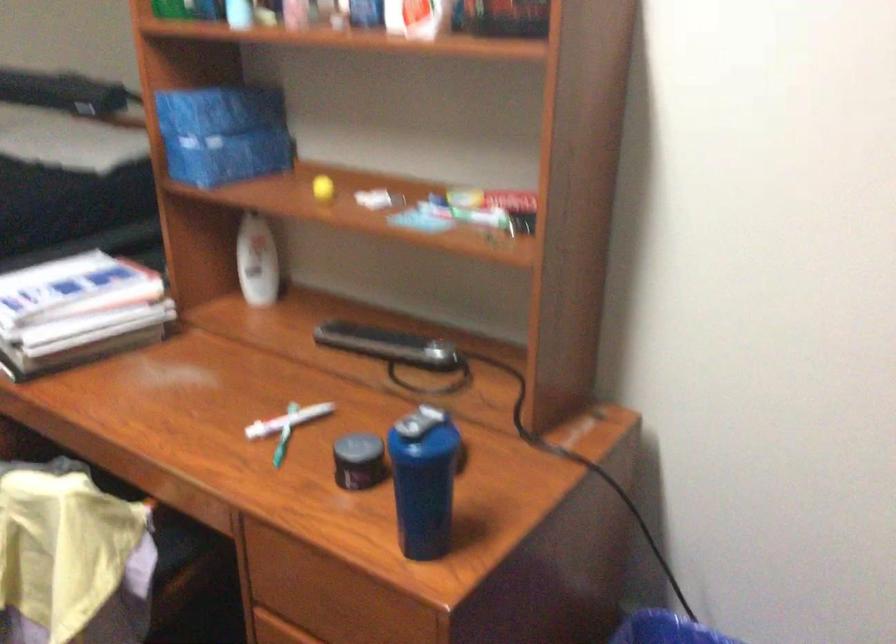
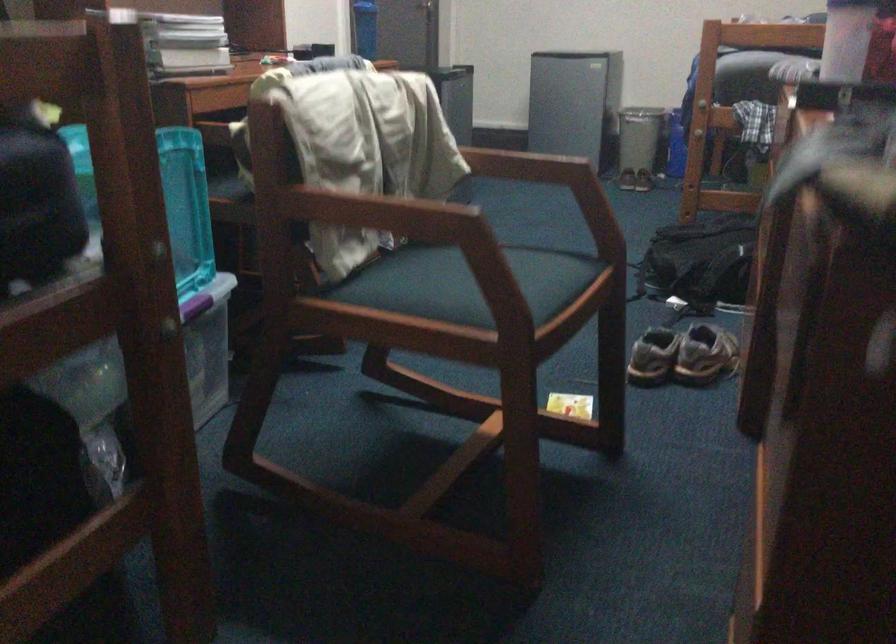
Where in the second image is the point corresponding to (369,504) from the first image?

(365, 28)